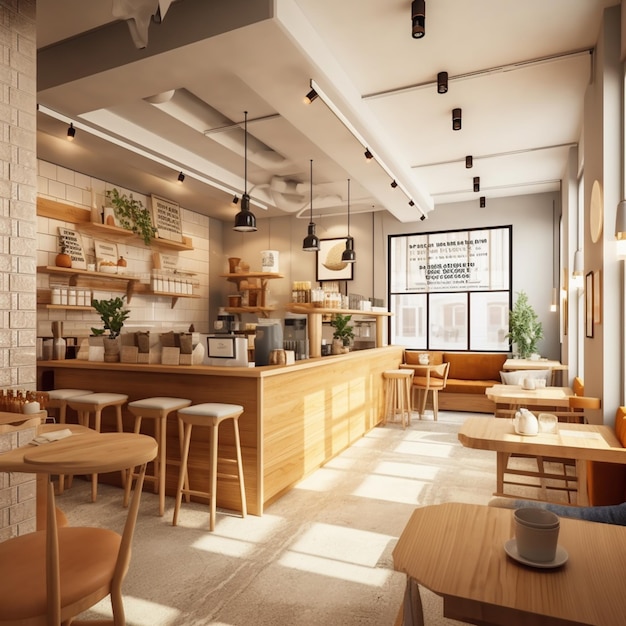
I want to click on chairs, so pos(73,565), pos(438,381), pos(590,398), pos(588,514), pos(570,412).